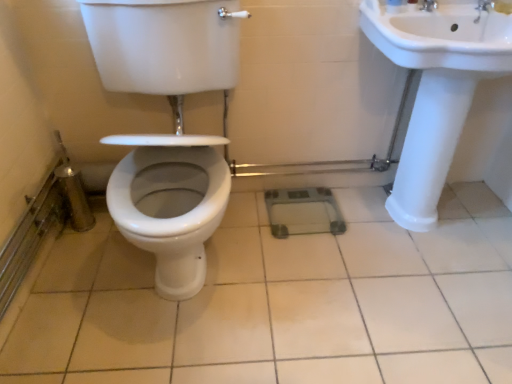
Question: Visually, is white glossy tile at center positioned to the left or to the right of silver metallic faucet at upper right?

Choices:
 (A) left
 (B) right

Answer: (A)

Question: Considering their positions, is white glossy tile at center located in front of or behind silver metallic faucet at upper right?

Choices:
 (A) behind
 (B) front

Answer: (B)

Question: Which of these objects is positioned farthest from the white glossy sink at right?

Choices:
 (A) white glossy toilet at center
 (B) silver metallic faucet at upper right
 (C) white glossy tile at center

Answer: (A)

Question: Estimate the real-world distances between objects in this image. Which object is closer to the silver metallic faucet at upper right?

Choices:
 (A) white glossy tile at center
 (B) white glossy sink at right
 (C) white glossy toilet at center

Answer: (B)